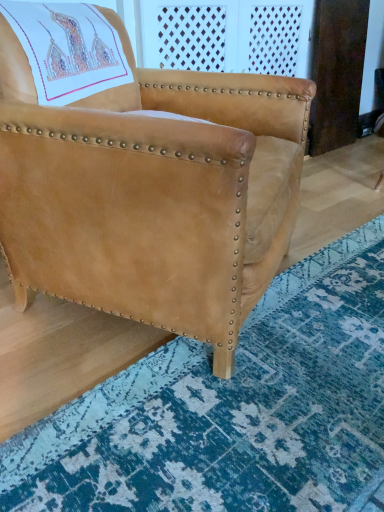
Question: From a real-world perspective, is blue textured rug at lower right physically located above or below suede tan chair at center?

Choices:
 (A) above
 (B) below

Answer: (B)

Question: From their relative heights in the image, would you say blue textured rug at lower right is taller or shorter than suede tan chair at center?

Choices:
 (A) tall
 (B) short

Answer: (B)

Question: Is blue textured rug at lower right wider or thinner than suede tan chair at center?

Choices:
 (A) thin
 (B) wide

Answer: (B)

Question: In terms of width, does suede tan chair at center look wider or thinner when compared to blue textured rug at lower right?

Choices:
 (A) wide
 (B) thin

Answer: (B)

Question: In terms of size, does suede tan chair at center appear bigger or smaller than blue textured rug at lower right?

Choices:
 (A) big
 (B) small

Answer: (A)

Question: Relative to blue textured rug at lower right, is suede tan chair at center in front or behind?

Choices:
 (A) behind
 (B) front

Answer: (A)

Question: Is suede tan chair at center taller or shorter than blue textured rug at lower right?

Choices:
 (A) tall
 (B) short

Answer: (A)